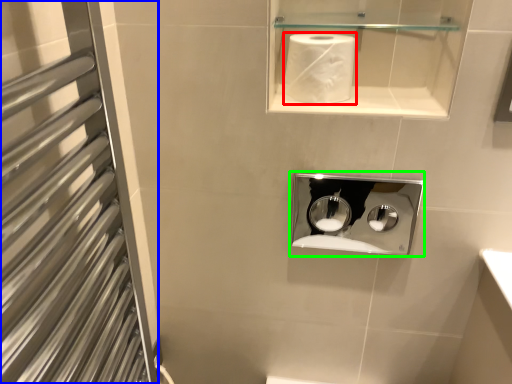
Question: Which object is the farthest from paper towel (highlighted by a red box)? Choose among these: screen door (highlighted by a blue box) or medicine cabinet (highlighted by a green box).

Choices:
 (A) screen door
 (B) medicine cabinet

Answer: (B)